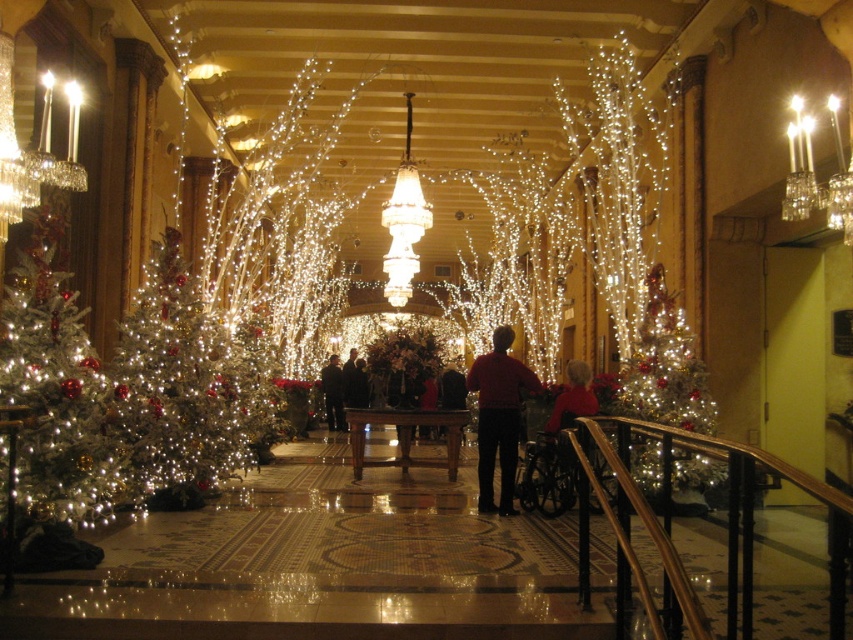
You are standing in the festive lobby and want to place a new decoration. You have two points marked on the floor at point (502, 513) and point (582, 368). Which point is closer to you where you can place the decoration?

Point (502, 513) is closer to the viewer than point (582, 368), so you should place the decoration at point (502, 513).

Based on the photo, you are a guest at the event and want to hang a decoration on the white glittering christmas tree at left. You are currently standing at the matte black jacket at center. Can you reach the tree from your current position without moving closer?

The white glittering christmas tree at left might be wider than matte black jacket at center, so it is possible that the tree is wide enough to have branches within reach from your current position at the matte black jacket at center. However, without knowing the exact distance between them, it is uncertain if you can reach it without moving closer.